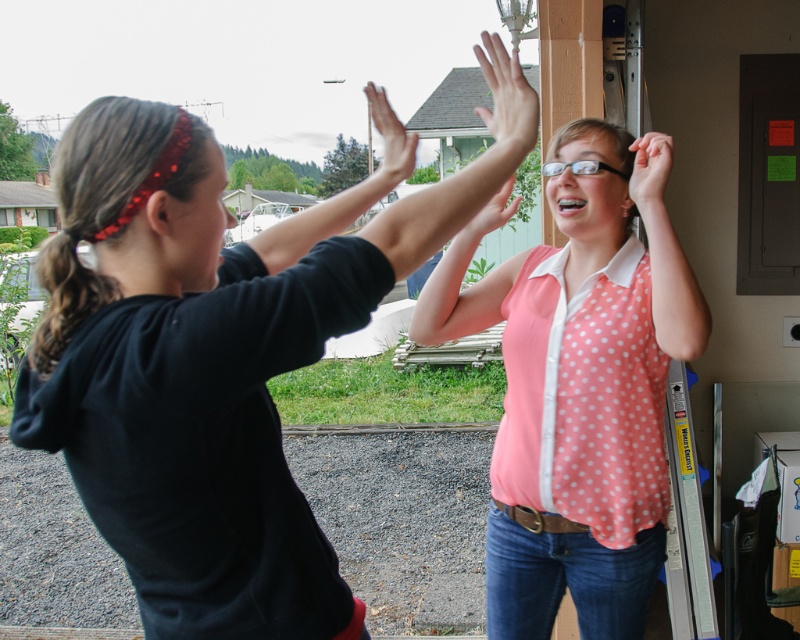
Question: Does pink polka dot blouse at center have a smaller size compared to matte pink shirt at upper right?

Choices:
 (A) yes
 (B) no

Answer: (B)

Question: Which object is the closest to the pink polka dot sleeve at upper center?

Choices:
 (A) pink polka dot blouse at center
 (B) pink polka dot blouse at upper right
 (C) matte black hand at upper center
 (D) matte pink shirt at upper right

Answer: (C)

Question: Which object is positioned closest to the pink polka dot blouse at upper right?

Choices:
 (A) black matte arm at upper center
 (B) pink polka dot shirt at upper center
 (C) pink polka dot sleeve at upper center

Answer: (C)

Question: Is pink polka dot blouse at upper right positioned at the back of black matte arm at upper center?

Choices:
 (A) no
 (B) yes

Answer: (B)

Question: Considering the relative positions of pink polka dot sleeve at upper center and matte pink shirt at upper right in the image provided, where is pink polka dot sleeve at upper center located with respect to matte pink shirt at upper right?

Choices:
 (A) left
 (B) right

Answer: (A)

Question: Which of the following is the farthest from the observer?

Choices:
 (A) (642, 150)
 (B) (392, 115)
 (C) (658, 243)
 (D) (376, 120)

Answer: (A)